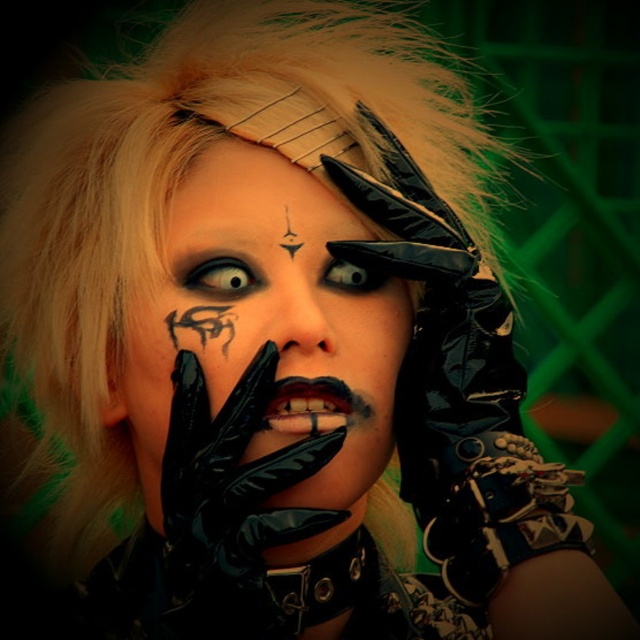
Question: Among these objects, which one is farthest from the camera?

Choices:
 (A) matte black face at center
 (B) black glossy glove at center
 (C) black tattoo at center

Answer: (C)

Question: Which object is positioned farthest from the smokey gray eye at center?

Choices:
 (A) matte black face at center
 (B) black glossy glove at center
 (C) black tattoo at center
 (D) black matte eye at center

Answer: (B)

Question: Does smokey gray eye at center appear under black matte eye at center?

Choices:
 (A) no
 (B) yes

Answer: (B)

Question: Does black glossy glove at center come behind black matte eye at center?

Choices:
 (A) no
 (B) yes

Answer: (A)

Question: Which point is closer to the camera?

Choices:
 (A) (276, 356)
 (B) (320, 483)
 (C) (170, 330)
 (D) (381, 285)

Answer: (A)

Question: Is black tattoo at center to the left of smokey gray eye at center from the viewer's perspective?

Choices:
 (A) yes
 (B) no

Answer: (A)